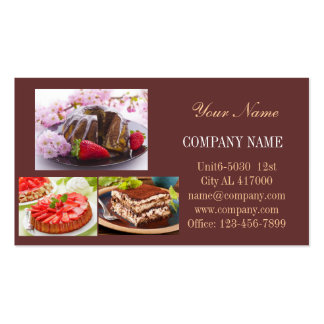
This screenshot has height=324, width=324. What are the coordinates of `utensil` in the screenshot? It's located at (105, 214), (27, 222).